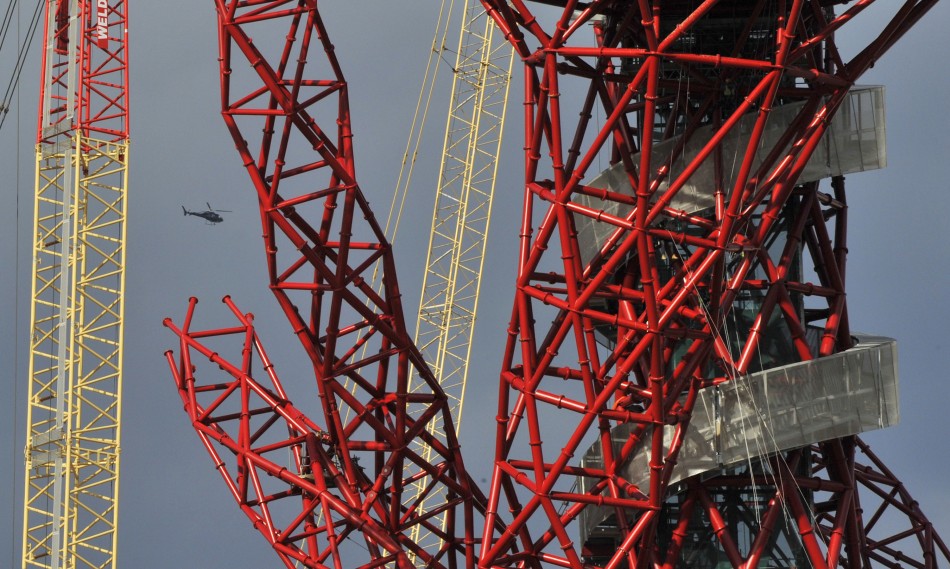
I want to click on cables, so click(780, 500), click(750, 490), click(800, 483), click(754, 457), click(751, 437), click(770, 402).